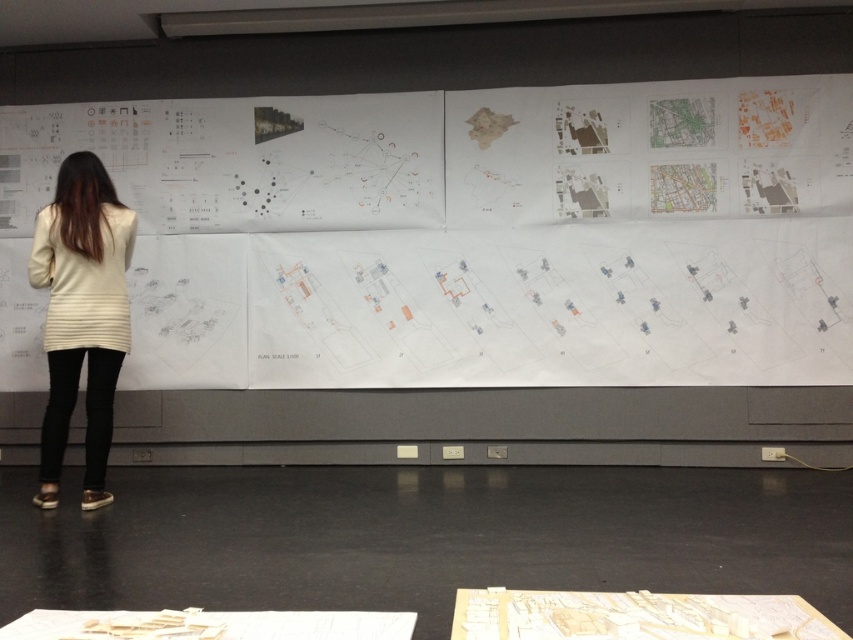
Question: Which object is farther from the camera taking this photo?

Choices:
 (A) white paper at upper center
 (B) creamy beige sweater at left

Answer: (A)

Question: Observing the image, what is the correct spatial positioning of white paper at upper center in reference to creamy beige sweater at left?

Choices:
 (A) left
 (B) right

Answer: (B)

Question: Can you confirm if white paper at upper center is positioned to the left of creamy beige sweater at left?

Choices:
 (A) no
 (B) yes

Answer: (A)

Question: Is white paper at upper center to the right of creamy beige sweater at left from the viewer's perspective?

Choices:
 (A) no
 (B) yes

Answer: (B)